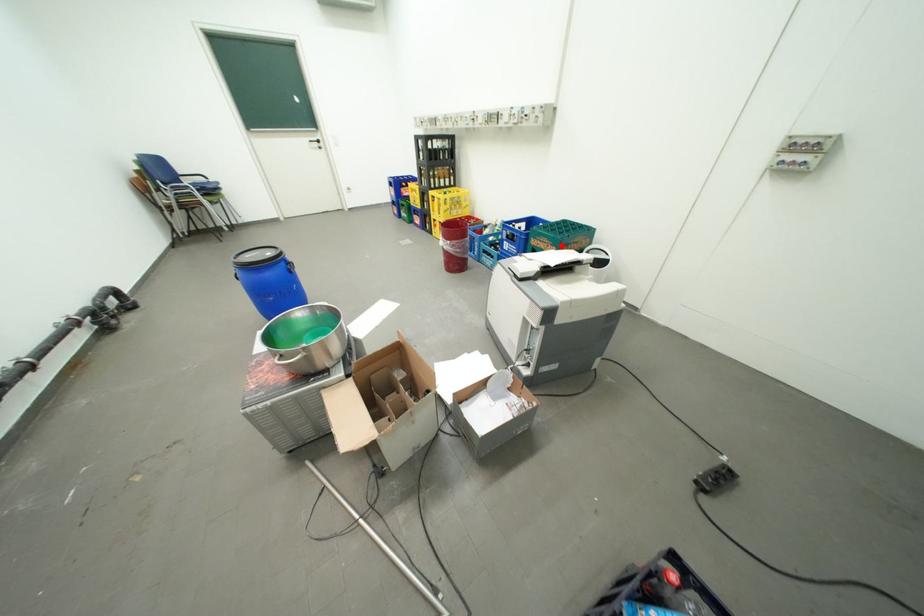
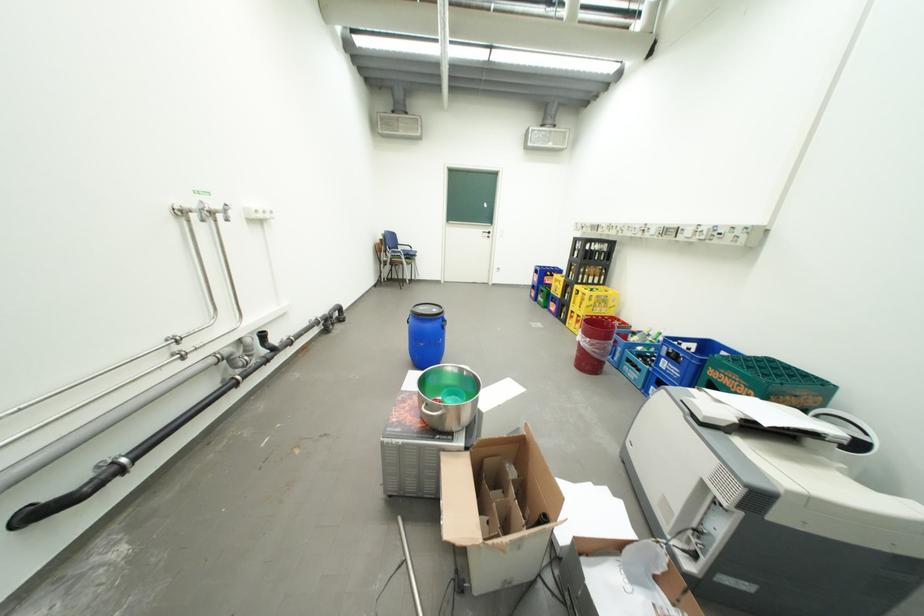
Question: I am providing you with two images of the same scene from different viewpoints. Image1 has a red point marked. In image2, the corresponding 3D location appears at what relative position? Reply with the corresponding letter.

Choices:
 (A) Closer
 (B) Farther

Answer: (A)